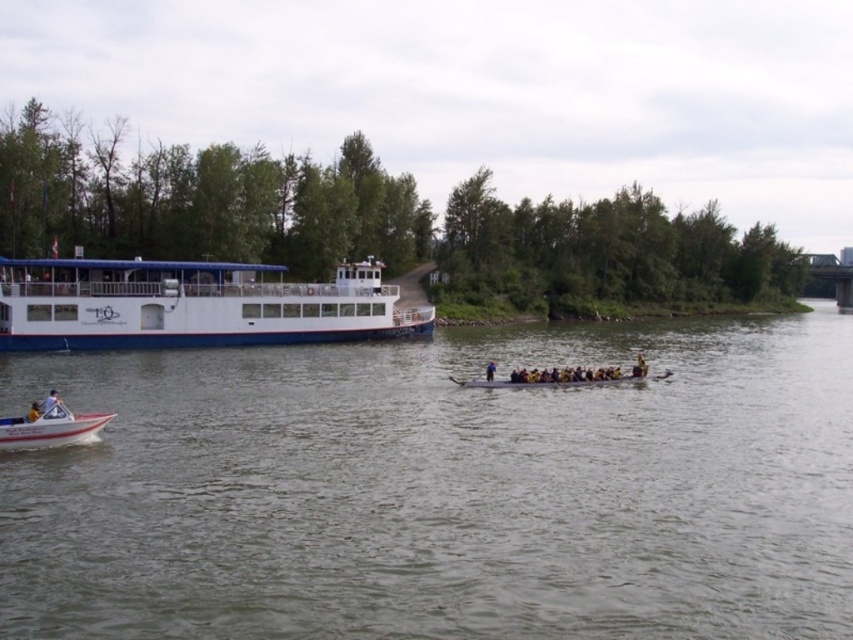
Question: Among these points, which one is farthest from the camera?

Choices:
 (A) (103, 416)
 (B) (494, 362)
 (C) (645, 365)

Answer: (B)

Question: Observing the image, what is the correct spatial positioning of greenish-gray water at center in reference to yellow life jacket at center?

Choices:
 (A) below
 (B) above

Answer: (A)

Question: Does white plastic motorboat at lower left appear on the right side of white fabric shirt at lower left?

Choices:
 (A) yes
 (B) no

Answer: (A)

Question: Which object is farther from the camera taking this photo?

Choices:
 (A) white glossy ferry at left
 (B) white fabric shirt at lower left
 (C) yellow life jacket at center
 (D) greenish-gray water at center

Answer: (A)

Question: Which point appears farthest from the camera in this image?

Choices:
 (A) (318, 289)
 (B) (39, 412)
 (C) (491, 362)

Answer: (A)

Question: Does white plastic motorboat at lower left appear on the left side of yellow life jackets at center?

Choices:
 (A) no
 (B) yes

Answer: (B)